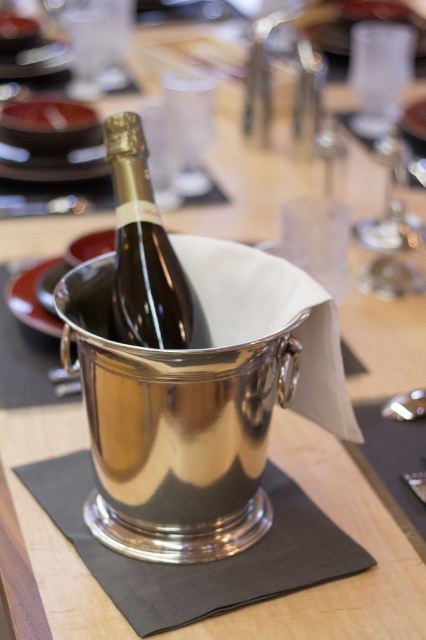
Question: Is shiny silver bottle at center bigger than polished metal spoon at lower right?

Choices:
 (A) yes
 (B) no

Answer: (A)

Question: Can you confirm if shiny silver bottle at center is positioned to the left of polished metal spoon at lower right?

Choices:
 (A) no
 (B) yes

Answer: (B)

Question: Which point appears farthest from the camera in this image?

Choices:
 (A) (393, 406)
 (B) (176, 269)

Answer: (A)

Question: Considering the relative positions of shiny silver bottle at center and polished metal spoon at lower right in the image provided, where is shiny silver bottle at center located with respect to polished metal spoon at lower right?

Choices:
 (A) below
 (B) above

Answer: (B)

Question: Which point appears farthest from the camera in this image?

Choices:
 (A) (388, 404)
 (B) (121, 202)

Answer: (A)

Question: Which point is farther to the camera?

Choices:
 (A) (411, 394)
 (B) (135, 189)

Answer: (A)